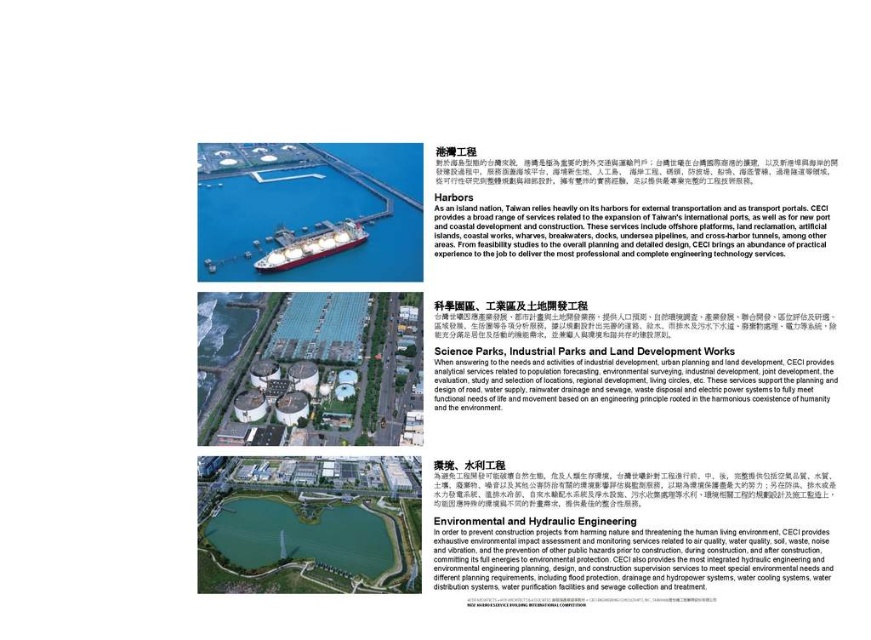
Question: Observing the image, what is the correct spatial positioning of white paper at center in reference to green concrete waterway at center?

Choices:
 (A) below
 (B) above

Answer: (B)

Question: Can you confirm if white paper at center is positioned below red glossy ship at center?

Choices:
 (A) yes
 (B) no

Answer: (A)

Question: Which object appears closest to the camera in this image?

Choices:
 (A) green concrete waterway at center
 (B) blue water at lower center
 (C) white paper at center
 (D) white matte ship at upper center

Answer: (C)

Question: Based on their relative distances, which object is farther from the red glossy ship at center?

Choices:
 (A) blue water at lower center
 (B) green concrete waterway at center

Answer: (B)

Question: Is blue water at lower center positioned in front of red glossy ship at center?

Choices:
 (A) yes
 (B) no

Answer: (A)

Question: Estimate the real-world distances between objects in this image. Which object is farther from the white matte ship at upper center?

Choices:
 (A) green concrete waterway at center
 (B) blue water at lower center

Answer: (B)